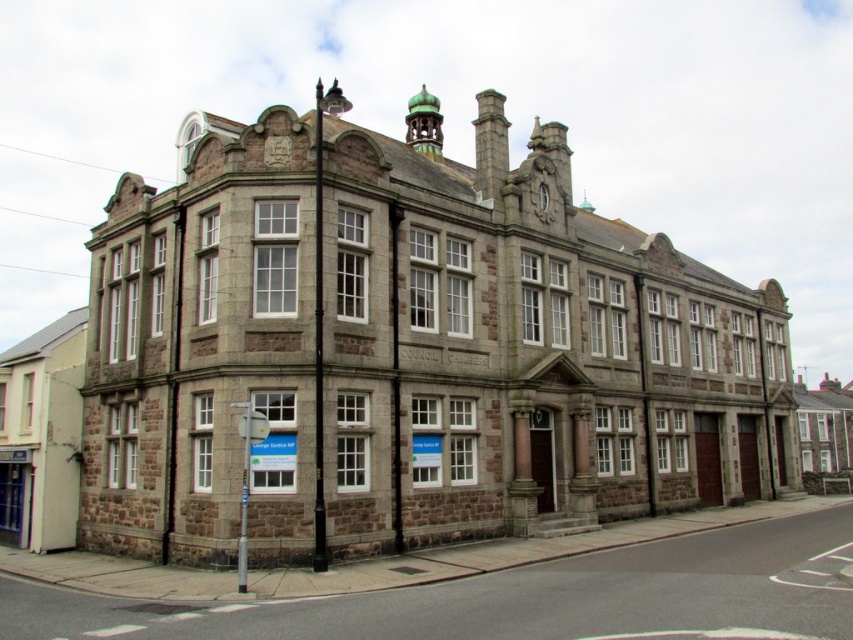
You are standing in front of the historic stone building and notice a point marked at coordinates (247, 477). Based on the scene description, can you determine which object this point corresponds to?

The point at coordinates (247, 477) corresponds to the metallic silver sign at lower left.

You are a visitor approaching the building and want to find the entrance. You see the metallic silver sign at lower left and the dark gray stone clock at upper center. Which object is closer to the entrance?

The metallic silver sign at lower left is positioned under the dark gray stone clock at upper center, so the metallic silver sign at lower left is closer to the entrance.

You are standing in front of the historic stone building and want to read the metallic silver sign at lower left and the dark gray stone clock at upper center. Which object is nearer to you?

The metallic silver sign at lower left is closer to the viewer than the dark gray stone clock at upper center.